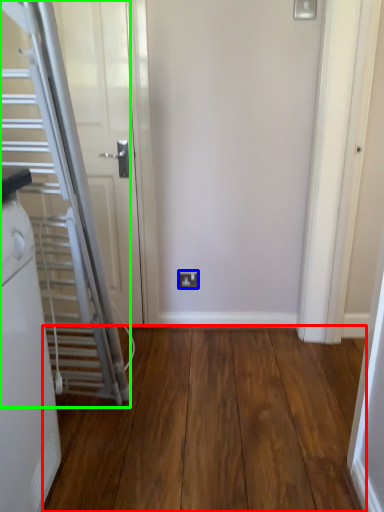
Question: Estimate the real-world distances between objects in this image. Which object is closer to corridor (highlighted by a red box), electric outlet (highlighted by a blue box) or escalator (highlighted by a green box)?

Choices:
 (A) electric outlet
 (B) escalator

Answer: (B)